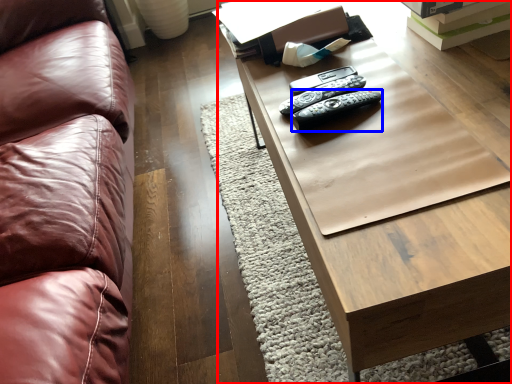
Question: Among these objects, which one is nearest to the camera, table (highlighted by a red box) or remote (highlighted by a blue box)?

Choices:
 (A) table
 (B) remote

Answer: (A)